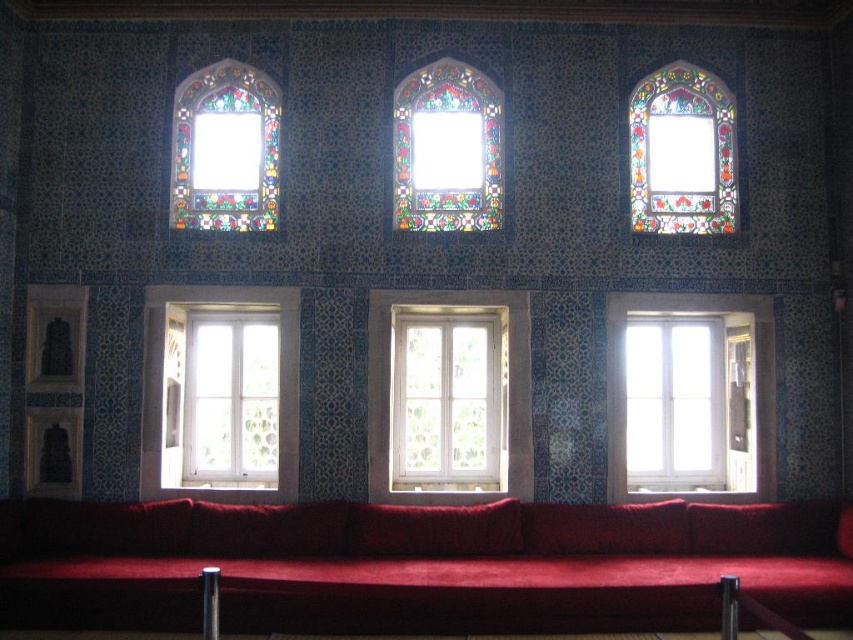
Question: Is stained glass window at upper left to the right of stained glass window at upper right from the viewer's perspective?

Choices:
 (A) no
 (B) yes

Answer: (A)

Question: Based on their relative distances, which object is nearer to the stained glass window at upper left?

Choices:
 (A) stained glass window at center
 (B) white wooden window at lower right

Answer: (A)

Question: Is white wooden window at center to the right of stained glass window at center from the viewer's perspective?

Choices:
 (A) yes
 (B) no

Answer: (A)

Question: Does velvet red couch at lower center lie in front of stained glass window at upper right?

Choices:
 (A) yes
 (B) no

Answer: (A)

Question: Which of these objects is positioned closest to the stained glass window at upper left?

Choices:
 (A) stained glass window at center
 (B) stained glass window at upper right

Answer: (A)

Question: Which object is closer to the camera taking this photo?

Choices:
 (A) stained glass window at upper right
 (B) velvet red couch at lower center
 (C) stained glass window at center
 (D) white wooden window at center

Answer: (B)